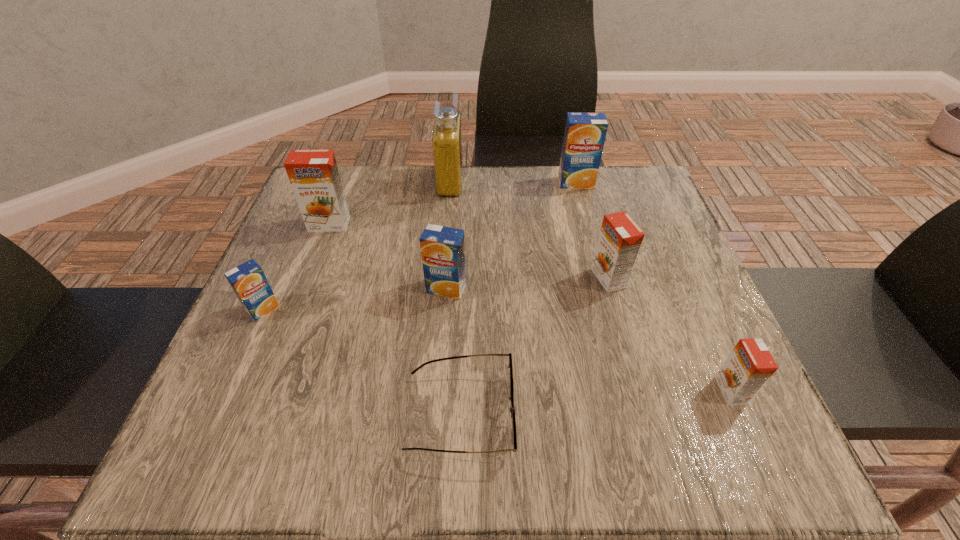
Locate an element on the screen. Image resolution: width=960 pixels, height=540 pixels. free space between the third orange juice from left to right and the shortest object is located at coordinates (453, 351).

This screenshot has height=540, width=960. In order to click on vacant point located between the tallest object and the sixth nearest object in this screenshot , I will do `click(390, 202)`.

The height and width of the screenshot is (540, 960). Identify the location of unoccupied position between the biggest orange orange juice and the farthest blue orange_juice. (452, 204).

This screenshot has height=540, width=960. What are the coordinates of `vacant area that lies between the biggest blue orange_juice and the farthest orange orange juice` in the screenshot? It's located at pyautogui.click(x=452, y=204).

I want to click on free space between the shortest object and the second orange orange juice from left to right, so click(x=534, y=346).

The image size is (960, 540). I want to click on vacant region between the biggest blue orange_juice and the perfume, so click(x=513, y=182).

Where is `vacant area that lies between the third orange juice from left to right and the biggest blue orange_juice`? vacant area that lies between the third orange juice from left to right and the biggest blue orange_juice is located at coordinates (511, 235).

The image size is (960, 540). What are the coordinates of `vacant region between the sixth nearest object and the rightmost blue orange_juice` in the screenshot? It's located at (452, 204).

Locate an element on the screen. The width and height of the screenshot is (960, 540). free space between the rightmost object and the leftmost blue orange_juice is located at coordinates (497, 350).

Identify the location of free space between the farthest orange juice and the fifth nearest orange juice. The height and width of the screenshot is (540, 960). [x=452, y=204].